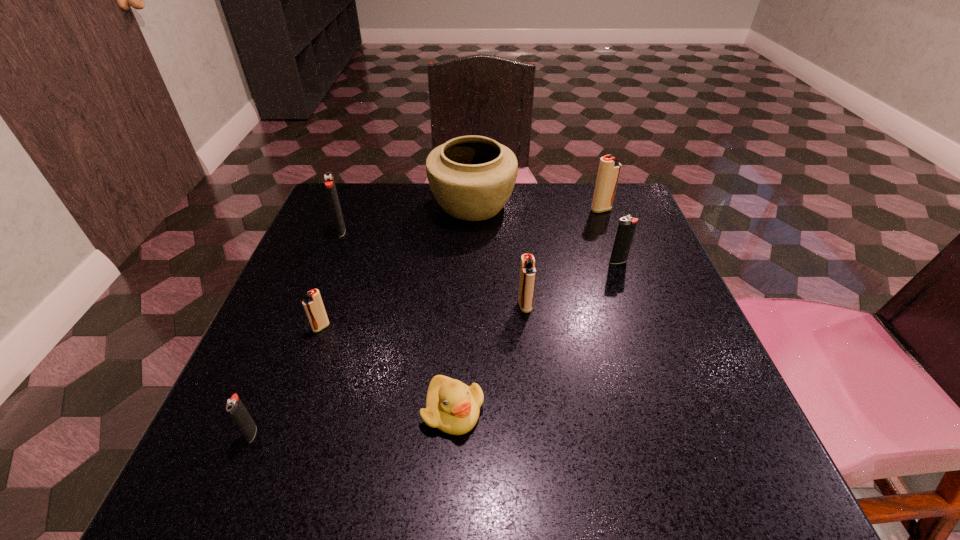
Find the location of `black igniter that is the second closest to the nearest black igniter`. black igniter that is the second closest to the nearest black igniter is located at coordinates (627, 225).

The image size is (960, 540). Identify the location of black igniter that stands as the third closest to the farthest red igniter. (235, 408).